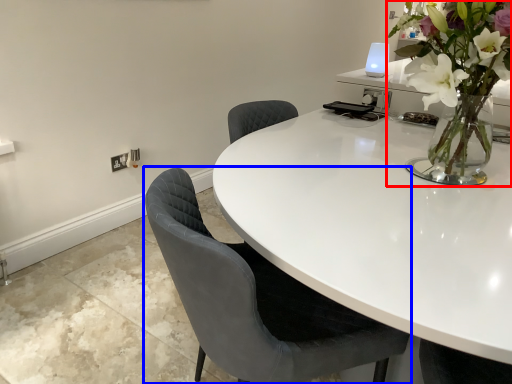
Question: Which object is further to the camera taking this photo, houseplant (highlighted by a red box) or chair (highlighted by a blue box)?

Choices:
 (A) houseplant
 (B) chair

Answer: (A)